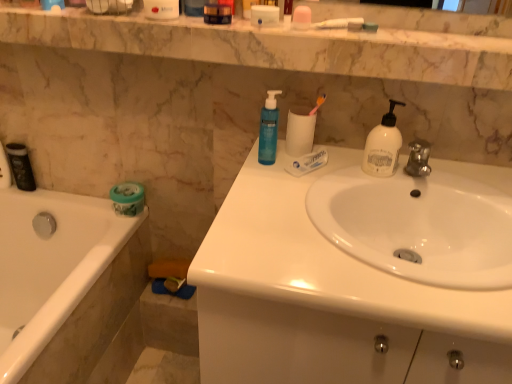
You are a GUI agent. You are given a task and a screenshot of the screen. Output one action in this format:
    pyautogui.click(x=<x>, y=<y>)
    Task: Click on the vacant space to the left of white matte soap dispenser at upper right, positioned as the 2th soap dispenser in left-to-right order
    This screenshot has width=512, height=384.
    Given the screenshot: What is the action you would take?
    pyautogui.click(x=342, y=171)